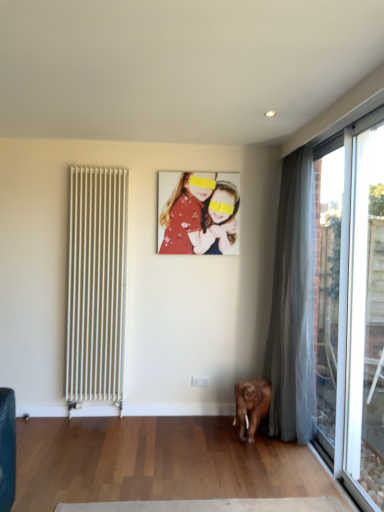
This screenshot has width=384, height=512. Find the location of `free point below white metal radiator at left (from a real-world perspective)`. free point below white metal radiator at left (from a real-world perspective) is located at coordinates [x=96, y=417].